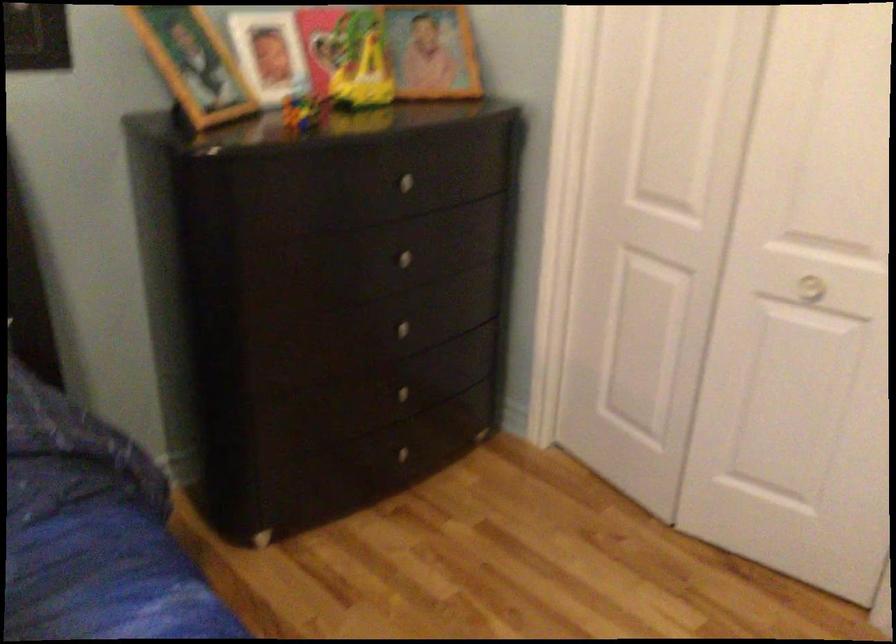
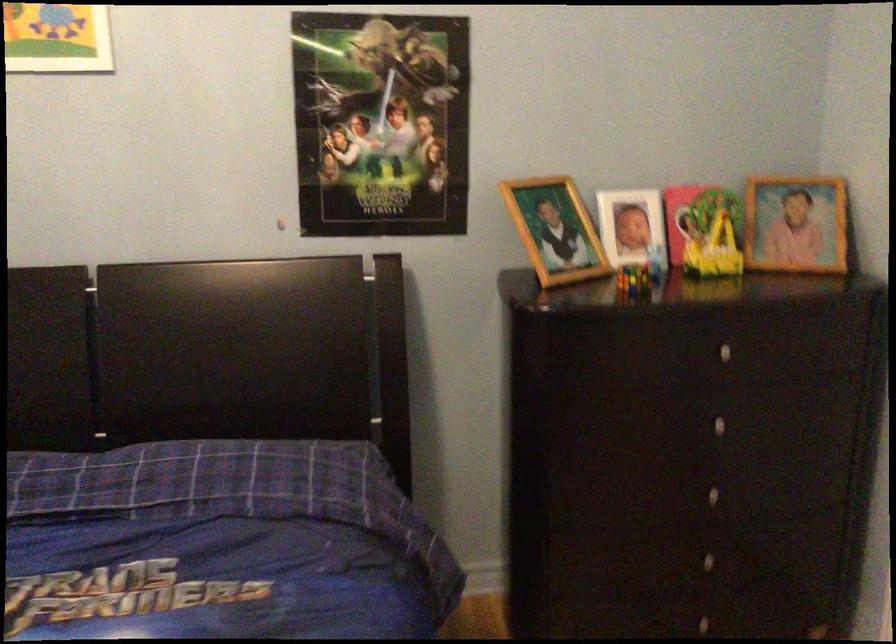
Where in the second image is the point corresponding to pixel 306 116 from the first image?

(634, 279)